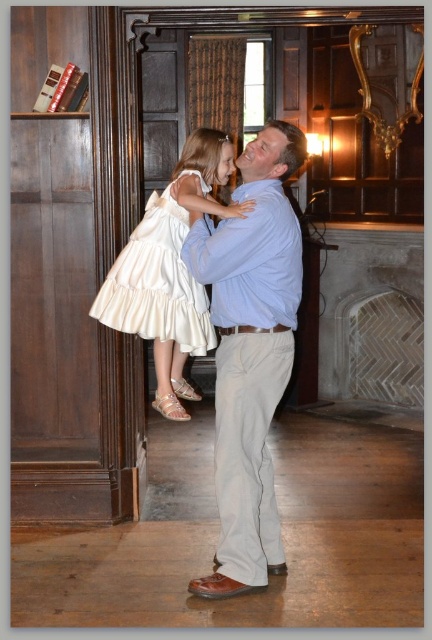
Question: Which point is closer to the camera taking this photo?

Choices:
 (A) (158, 237)
 (B) (224, 492)

Answer: (B)

Question: Can you confirm if light blue shirt at center is bigger than white satin dress at center?

Choices:
 (A) no
 (B) yes

Answer: (A)

Question: Which point is farther to the camera?

Choices:
 (A) white satin dress at center
 (B) light blue shirt at center

Answer: (A)

Question: Is light blue shirt at center positioned at the back of white satin dress at center?

Choices:
 (A) no
 (B) yes

Answer: (A)

Question: Which of the following is the closest to the observer?

Choices:
 (A) (184, 332)
 (B) (259, 202)

Answer: (B)

Question: Does light blue shirt at center have a larger size compared to white satin dress at center?

Choices:
 (A) no
 (B) yes

Answer: (A)